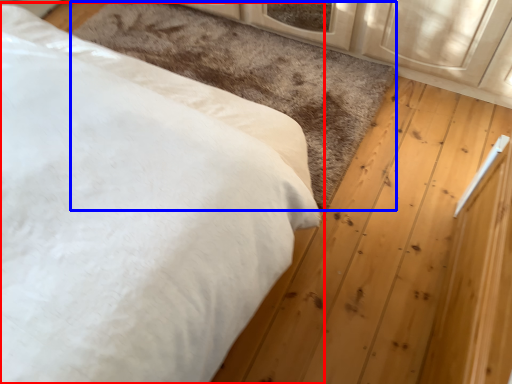
Question: Which object appears farthest to the camera in this image, bed (highlighted by a red box) or mat (highlighted by a blue box)?

Choices:
 (A) bed
 (B) mat

Answer: (B)